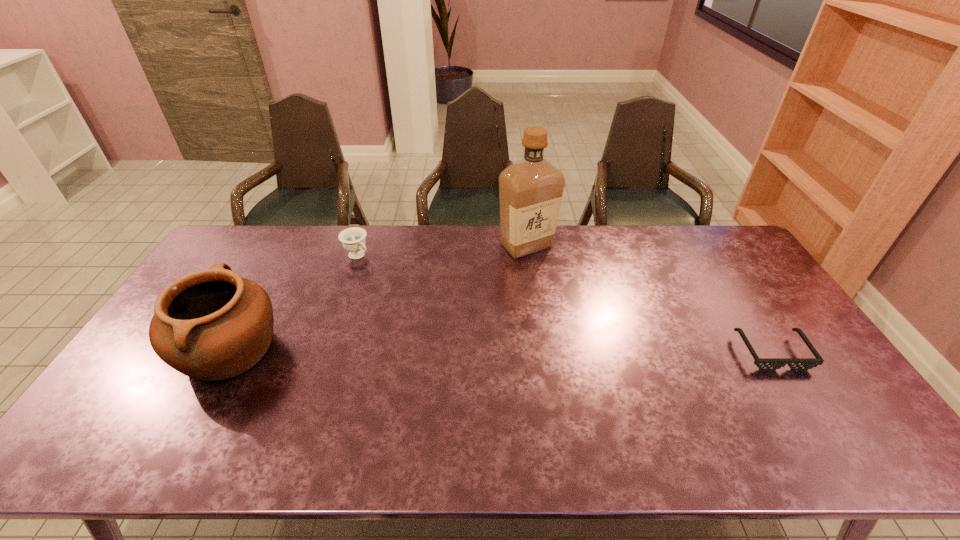
Identify the location of vacant space that is in between the third object from right to left and the third object from left to right. The image size is (960, 540). (442, 251).

Image resolution: width=960 pixels, height=540 pixels. Find the location of `vacant area that lies between the second shortest object and the tallest object`. vacant area that lies between the second shortest object and the tallest object is located at coordinates (442, 251).

Locate an element on the screen. This screenshot has height=540, width=960. vacant space that's between the third object from left to right and the teacup is located at coordinates (442, 251).

Locate an element on the screen. The image size is (960, 540). free space between the leftmost object and the third object from left to right is located at coordinates [x=378, y=298].

You are a GUI agent. You are given a task and a screenshot of the screen. Output one action in this format:
    pyautogui.click(x=<x>, y=<y>)
    Task: Click on the blank region between the teacup and the pottery
    The width and height of the screenshot is (960, 540).
    Given the screenshot: What is the action you would take?
    pyautogui.click(x=294, y=303)

This screenshot has width=960, height=540. What are the coordinates of `vacant space that's between the third shortest object and the third object from right to left` in the screenshot? It's located at (294, 303).

I want to click on object that stands as the third closest to the leftmost object, so click(764, 364).

In order to click on object that is the closest to the tallest object in this screenshot , I will do `click(353, 239)`.

Where is `free space that satisfies the following two spatial constraints: 1. on the back side of the teacup; 2. on the left side of the leftmost object`? The width and height of the screenshot is (960, 540). free space that satisfies the following two spatial constraints: 1. on the back side of the teacup; 2. on the left side of the leftmost object is located at coordinates (282, 255).

Locate an element on the screen. The image size is (960, 540). blank area in the image that satisfies the following two spatial constraints: 1. on the back side of the third shortest object; 2. on the right side of the liquor is located at coordinates (287, 246).